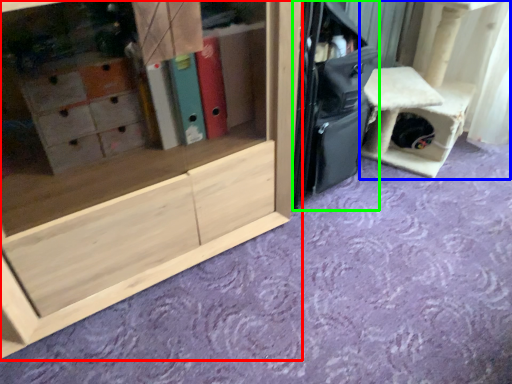
Question: Which is nearer to the cabinetry (highlighted by a red box)? furniture (highlighted by a blue box) or luggage (highlighted by a green box).

Choices:
 (A) furniture
 (B) luggage

Answer: (B)